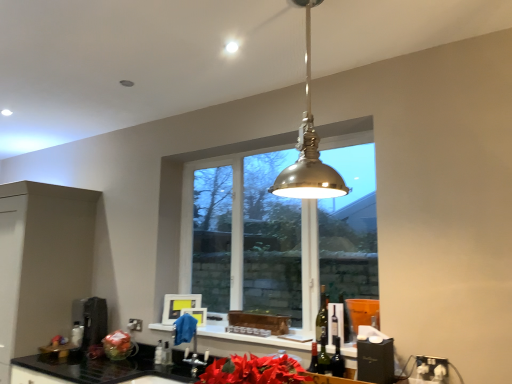
Question: Can you confirm if translucent glass wine bottle at center is thinner than clear glass bottle at lower center, marked as the second bottle in a right-to-left arrangement?

Choices:
 (A) no
 (B) yes

Answer: (A)

Question: Is translucent glass wine bottle at center shorter than clear glass bottle at lower center, which ranks as the 1th bottle in left-to-right order?

Choices:
 (A) no
 (B) yes

Answer: (A)

Question: Is translucent glass wine bottle at center at the right side of clear glass bottle at lower center, which ranks as the 1th bottle in left-to-right order?

Choices:
 (A) yes
 (B) no

Answer: (A)

Question: Is translucent glass wine bottle at center outside clear glass bottle at lower center, which ranks as the 1th bottle in left-to-right order?

Choices:
 (A) no
 (B) yes

Answer: (B)

Question: Can you confirm if translucent glass wine bottle at center is wider than clear glass bottle at lower center, marked as the second bottle in a right-to-left arrangement?

Choices:
 (A) no
 (B) yes

Answer: (B)

Question: Does translucent glass wine bottle at center lie behind clear glass bottle at lower center, marked as the second bottle in a right-to-left arrangement?

Choices:
 (A) yes
 (B) no

Answer: (B)

Question: Considering the relative sizes of clear glass bottle at lower center, which is the 1th bottle from right to left, and metallic stainless steel coffee machine at lower left in the image provided, is clear glass bottle at lower center, which is the 1th bottle from right to left, shorter than metallic stainless steel coffee machine at lower left?

Choices:
 (A) no
 (B) yes

Answer: (B)

Question: Is clear glass bottle at lower center, which is the 1th bottle from right to left, facing towards metallic stainless steel coffee machine at lower left?

Choices:
 (A) yes
 (B) no

Answer: (B)

Question: Does clear glass bottle at lower center, which is counted as the 2th bottle, starting from the left, lie behind metallic stainless steel coffee machine at lower left?

Choices:
 (A) yes
 (B) no

Answer: (B)

Question: From the image's perspective, is clear glass bottle at lower center, which is the 1th bottle from right to left, on metallic stainless steel coffee machine at lower left?

Choices:
 (A) yes
 (B) no

Answer: (B)

Question: Can you confirm if clear glass bottle at lower center, which is counted as the 2th bottle, starting from the left, is positioned to the left of metallic stainless steel coffee machine at lower left?

Choices:
 (A) yes
 (B) no

Answer: (B)

Question: From a real-world perspective, is clear glass bottle at lower center, which is counted as the 2th bottle, starting from the left, under metallic stainless steel coffee machine at lower left?

Choices:
 (A) no
 (B) yes

Answer: (B)

Question: Is polished brass pendant light at center with green glass bottle at center?

Choices:
 (A) yes
 (B) no

Answer: (B)